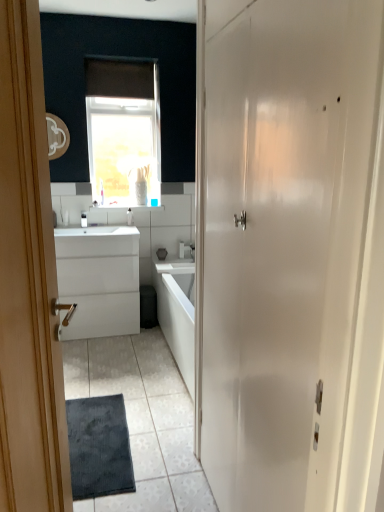
Identify the location of free point in front of white plastic toothbrush at center, which is the 1th toiletry in left-to-right order. (77, 230).